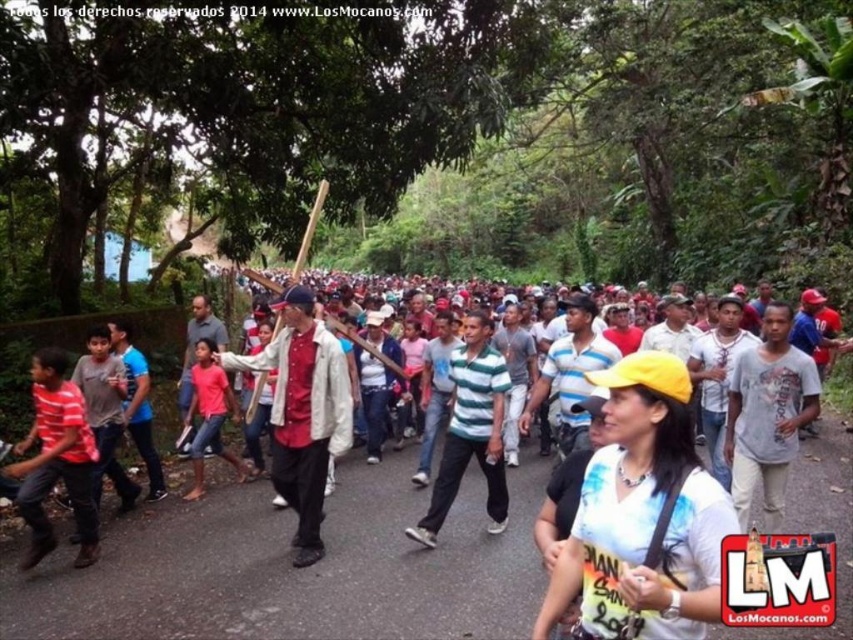
Question: Among these points, which one is nearest to the camera?

Choices:
 (A) (90, 458)
 (B) (624, 536)
 (C) (172, 509)
 (D) (758, 376)

Answer: (B)

Question: Estimate the real-world distances between objects in this image. Which object is farther from the gray cotton shirt at center?

Choices:
 (A) green striped shirt at center
 (B) red shirt at center
 (C) striped cotton shirt at left
 (D) yellow matte cap at center

Answer: (C)

Question: Which point appears farthest from the camera in this image?

Choices:
 (A) (677, 529)
 (B) (790, 374)
 (C) (492, 448)

Answer: (C)

Question: Is red shirt at center positioned before green striped shirt at center?

Choices:
 (A) yes
 (B) no

Answer: (A)

Question: Is red shirt at center to the right of striped cotton shirt at left from the viewer's perspective?

Choices:
 (A) yes
 (B) no

Answer: (A)

Question: Observing the image, what is the correct spatial positioning of yellow fabric shirt at center in reference to red shirt at center?

Choices:
 (A) above
 (B) below

Answer: (B)